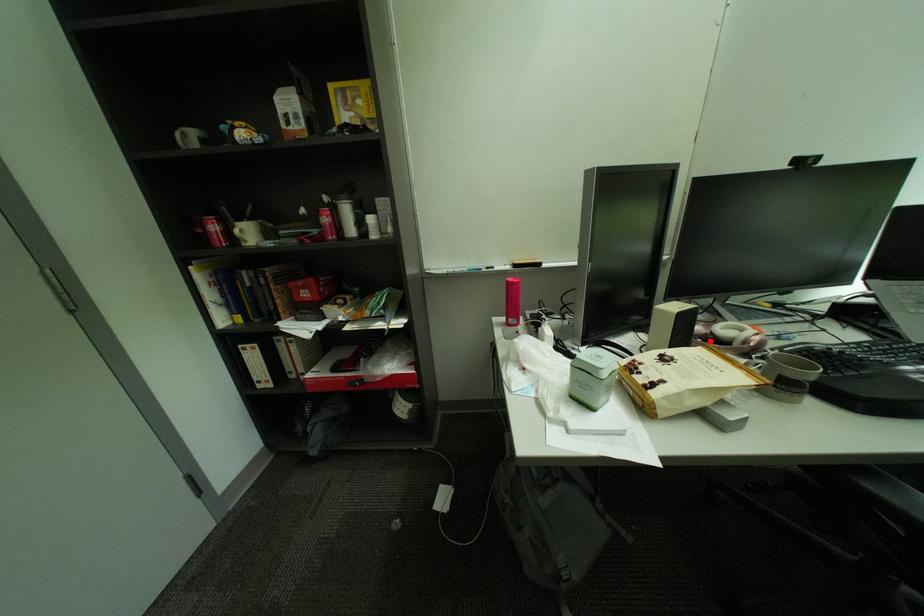
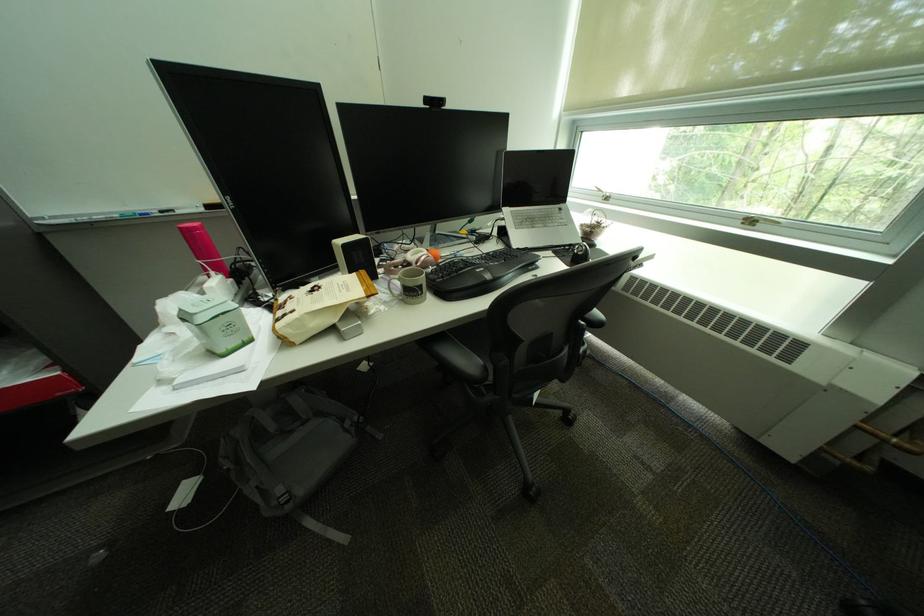
In the second image, find the point that corresponds to the highlighted location in the first image.

(410, 268)